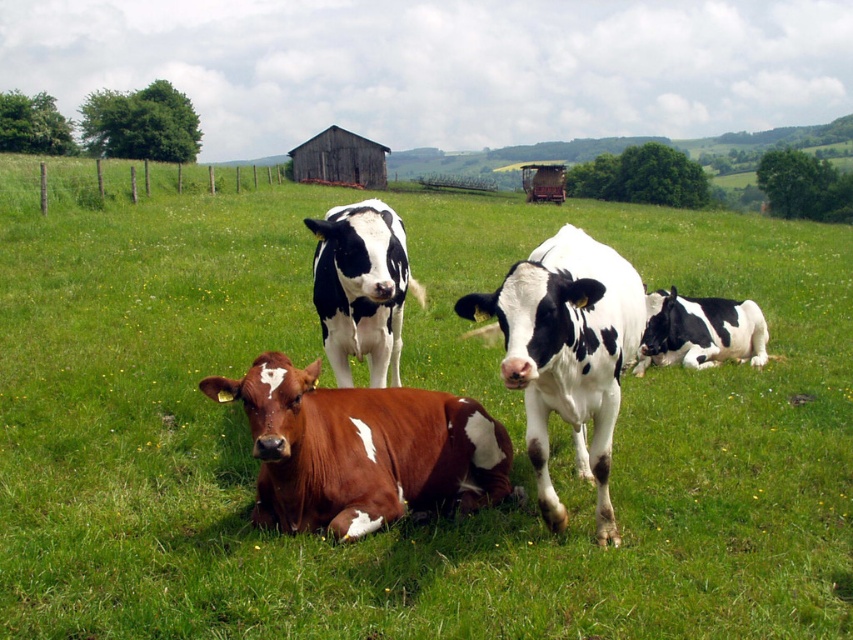
Does white-spotted cow at center appear on the right side of black-and-white spotted cow at center?

Incorrect, white-spotted cow at center is not on the right side of black-and-white spotted cow at center.

Does point (531, 417) come farther from viewer compared to point (741, 323)?

No, (531, 417) is in front of (741, 323).

Locate an element on the screen. white-spotted cow at center is located at coordinates (572, 353).

Does brown speckled cow at center have a lesser width compared to black and white spotted cow at center?

In fact, brown speckled cow at center might be wider than black and white spotted cow at center.

Can you confirm if brown speckled cow at center is wider than black and white spotted cow at center?

Correct, the width of brown speckled cow at center exceeds that of black and white spotted cow at center.

Which is behind, point (416, 438) or point (410, 282)?

The point (410, 282) is behind.

This screenshot has width=853, height=640. In order to click on brown speckled cow at center in this screenshot , I will do `click(361, 449)`.

In the scene shown: Can you confirm if brown speckled cow at center is smaller than white-spotted fur cow at center?

Yes.

Between brown speckled cow at center and white-spotted fur cow at center, which one is positioned higher?

white-spotted fur cow at center is above.

Who is more forward, (397, 424) or (605, 438)?

Positioned in front is point (605, 438).

The width and height of the screenshot is (853, 640). I want to click on brown speckled cow at center, so click(361, 449).